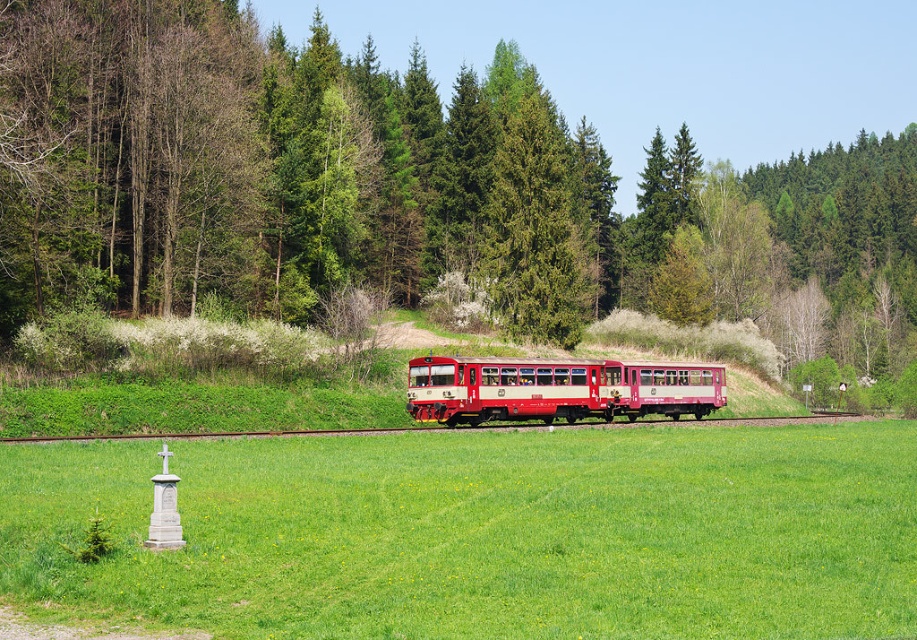
You are a photographer standing in the green grassy field at lower center. You want to take a photo of the matte red train at center. Is the train visible from your current position?

The green grassy field at lower center is in front of the matte red train at center, so the train is behind the field. Since the field is grassy and not obstructive, the matte red train at center should be visible from your current position in the green grassy field at lower center.

You are a bird flying over the rural landscape. You want to land on the highest point between the green textured pine tree at center and the matte red train at center. Which one should you choose?

The green textured pine tree at center is much taller than the matte red train at center, so you should choose the green textured pine tree at center to land on the highest point.